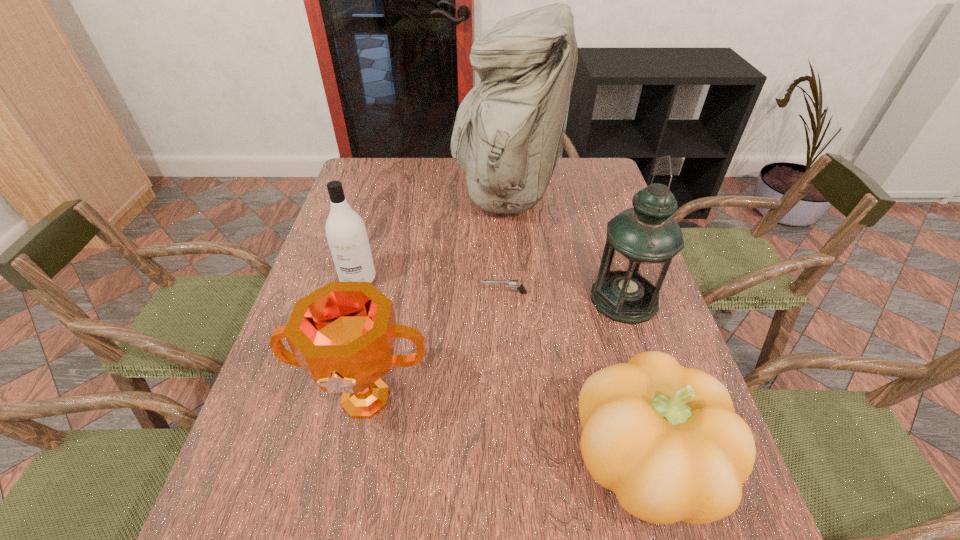
What are the coordinates of `vacant space at the left edge` in the screenshot? It's located at (376, 211).

Locate an element on the screen. blank space at the far left corner is located at coordinates (377, 170).

In the image, there is a desktop. Where is `vacant space at the far right corner`? This screenshot has width=960, height=540. vacant space at the far right corner is located at coordinates (596, 187).

The height and width of the screenshot is (540, 960). In order to click on unoccupied area between the farthest object and the pistol in this screenshot , I will do `click(504, 244)`.

Image resolution: width=960 pixels, height=540 pixels. What are the coordinates of `empty location between the shampoo and the backpack` in the screenshot? It's located at (432, 237).

Image resolution: width=960 pixels, height=540 pixels. I want to click on empty space that is in between the shortest object and the tallest object, so click(x=504, y=244).

I want to click on free space between the shampoo and the shortest object, so click(x=431, y=286).

Locate an element on the screen. The image size is (960, 540). free space between the tallest object and the shampoo is located at coordinates (432, 237).

Where is `free spot between the second tallest object and the tallest object`? Image resolution: width=960 pixels, height=540 pixels. free spot between the second tallest object and the tallest object is located at coordinates (564, 247).

The image size is (960, 540). Find the location of `object that can be found as the fourth closest to the shortest object`. object that can be found as the fourth closest to the shortest object is located at coordinates [x=346, y=233].